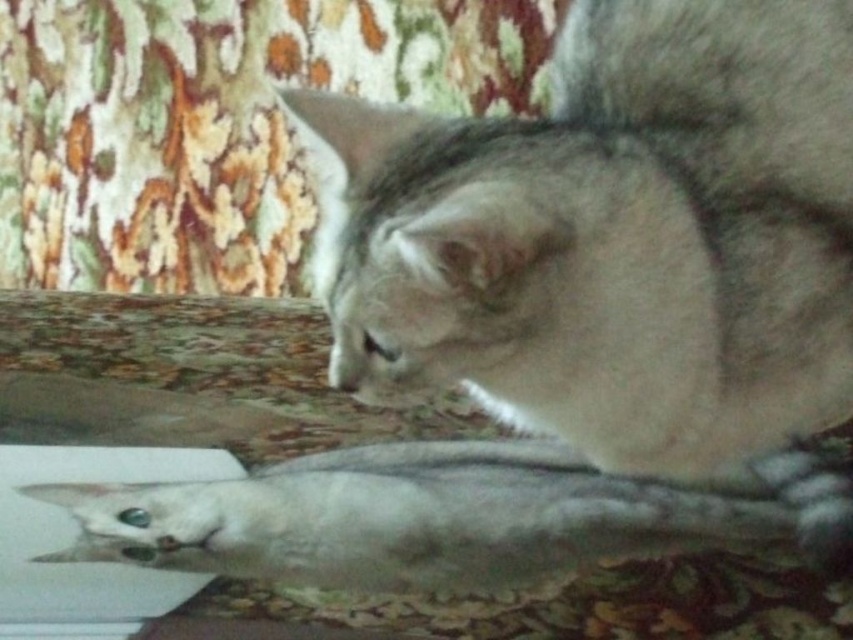
Which is more to the left, fuzzy white cat at center or white matte fish at lower center?

white matte fish at lower center

Can you confirm if fuzzy white cat at center is thinner than white matte fish at lower center?

Yes.

This screenshot has width=853, height=640. What do you see at coordinates (616, 237) in the screenshot? I see `fuzzy white cat at center` at bounding box center [616, 237].

Where is `fuzzy white cat at center`? This screenshot has height=640, width=853. fuzzy white cat at center is located at coordinates (616, 237).